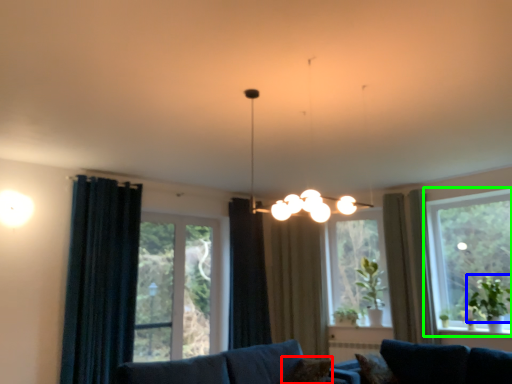
Question: Which is nearer to the pillow (highlighted by a red box)? plant (highlighted by a blue box) or window (highlighted by a green box).

Choices:
 (A) plant
 (B) window

Answer: (A)